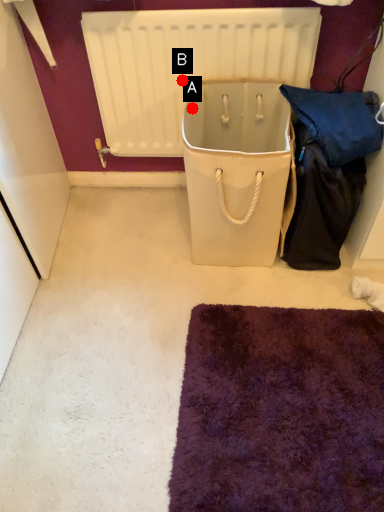
Question: Two points are circled on the image, labeled by A and B beside each circle. Which point appears farthest from the camera in this image?

Choices:
 (A) A is further
 (B) B is further

Answer: (B)